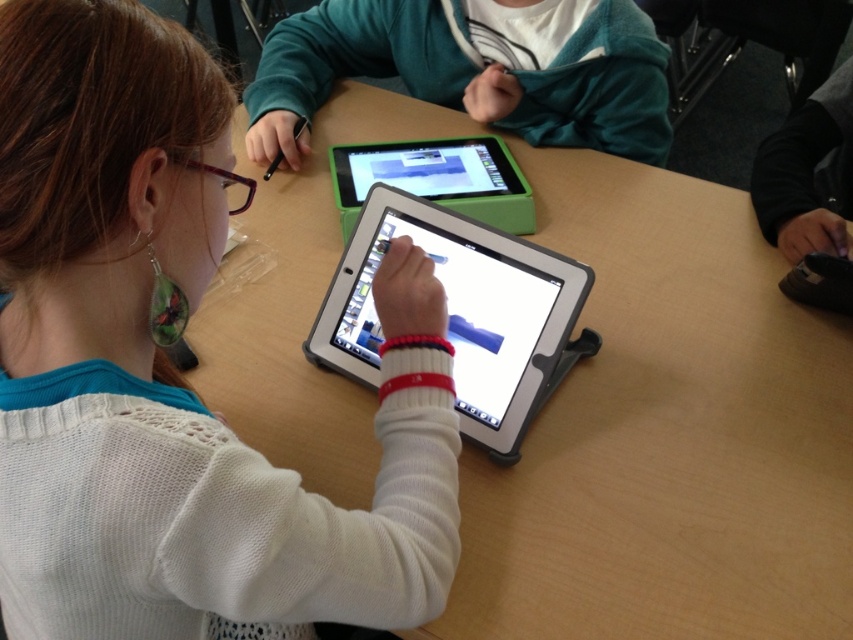
You are a teacher standing at the front of the classroom. You notice two points on the tablet screen of the girl with red hair. The first point is at coordinates point (462, 566) and the second point is at point (474, 164). Which point is closer to you, the teacher?

Point (462, 566) is in front of point (474, 164), so the point closer to you would be point (462, 566).

In the scene shown: You are standing in a classroom where there are two points marked on the floor. The first point is at coordinate point (505, 483) and the second is at coordinate point (315, 19). If you want to move closer to the child with the tablet, which point should you step on?

Point (505, 483) is closer to the viewer than point (315, 19), so stepping on point (505, 483) would place you closer to the child with the tablet.

The scene shows a classroom with two children working on tablets. There is a point marked at coordinates [471,72]. What object is located at this point?

The point at coordinates [471,72] corresponds to the teal fleece hoodie at upper center.